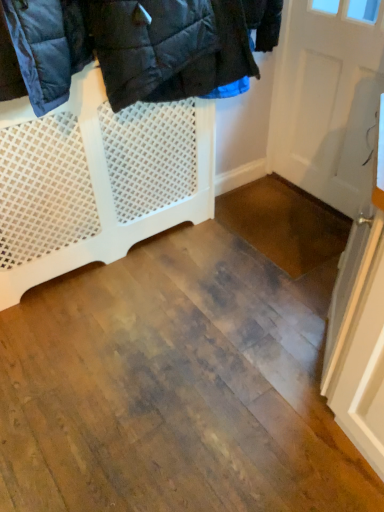
Find the location of a particular element. The width and height of the screenshot is (384, 512). free spot below white mesh gate at upper left (from a real-world perspective) is located at coordinates (118, 260).